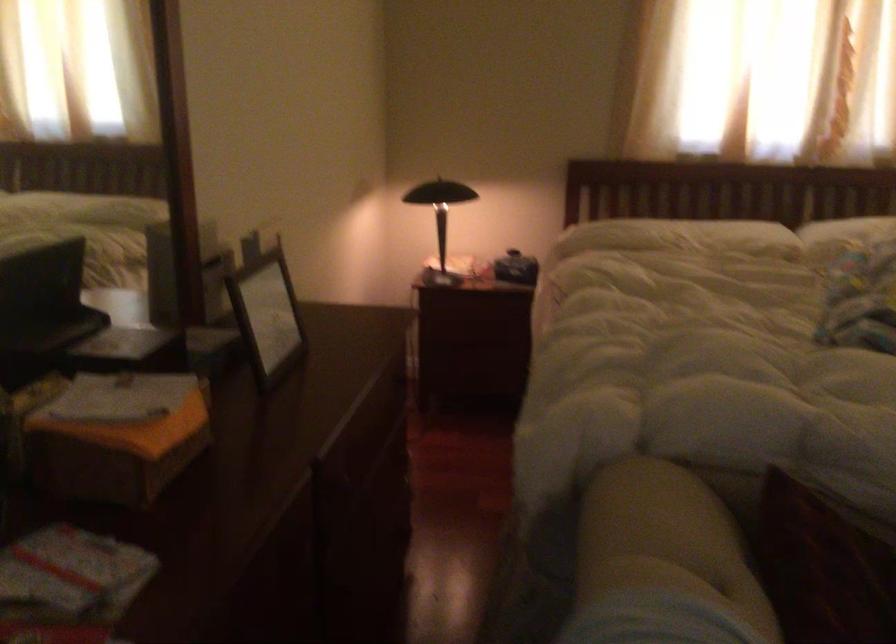
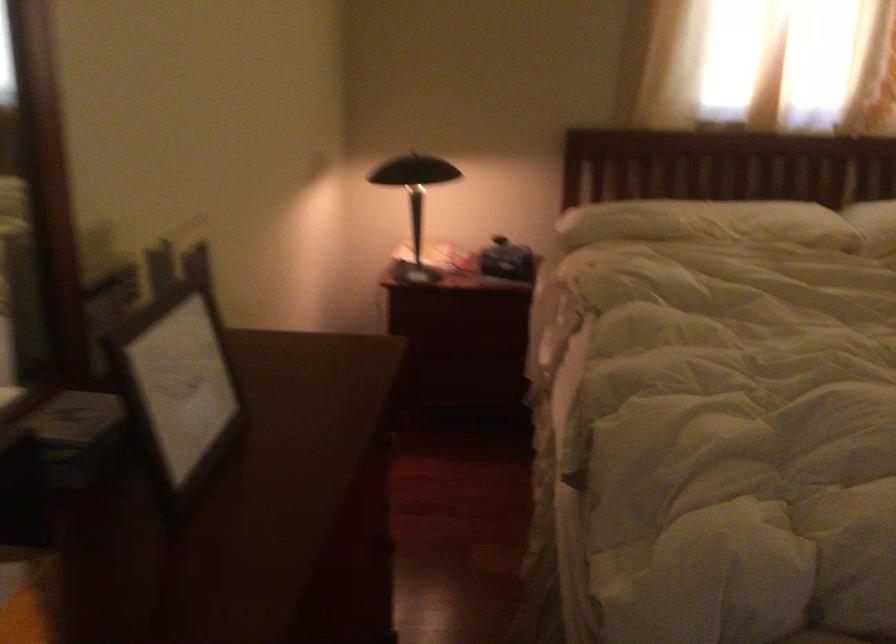
Question: Based on the continuous images, in which direction is the camera rotating? Reply with the corresponding letter.

Choices:
 (A) Left
 (B) Right
 (C) Up
 (D) Down

Answer: (B)